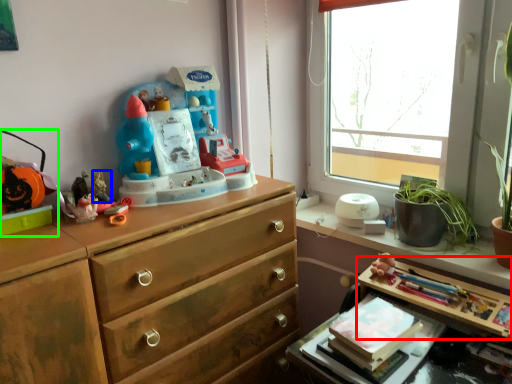
Question: Which object is the closest to the table (highlighted by a red box)? Choose among these: toy (highlighted by a blue box) or toy (highlighted by a green box).

Choices:
 (A) toy
 (B) toy

Answer: (A)